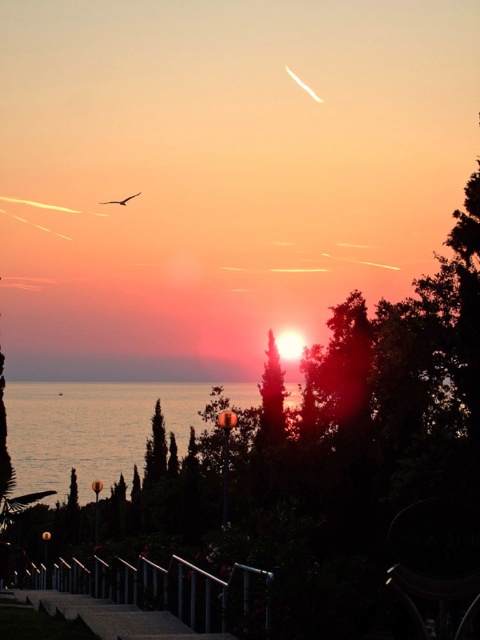
Question: Can you confirm if transparent glass water at lower left is positioned to the left of matte black bird at upper center?

Choices:
 (A) yes
 (B) no

Answer: (B)

Question: Does transparent glass water at lower left appear on the right side of matte black bird at upper center?

Choices:
 (A) yes
 (B) no

Answer: (A)

Question: Considering the relative positions of transparent glass water at lower left and green matte tree at center in the image provided, where is transparent glass water at lower left located with respect to green matte tree at center?

Choices:
 (A) above
 (B) below

Answer: (B)

Question: Which object appears closest to the camera in this image?

Choices:
 (A) matte black bird at upper center
 (B) green matte tree at center
 (C) transparent glass water at lower left

Answer: (B)

Question: Which of these objects is positioned farthest from the matte black bird at upper center?

Choices:
 (A) green matte tree at center
 (B) transparent glass water at lower left

Answer: (A)

Question: Among these points, which one is farthest from the camera?

Choices:
 (A) (133, 195)
 (B) (145, 403)

Answer: (B)